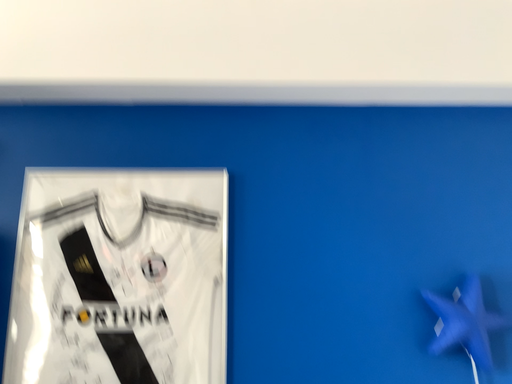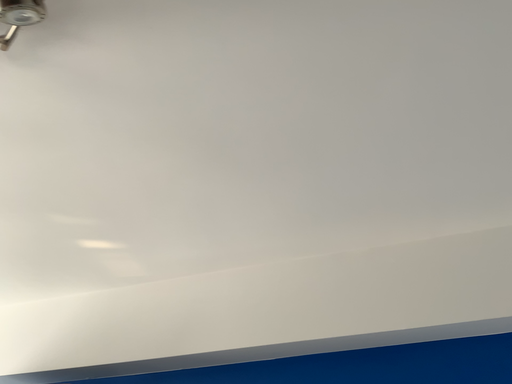
Question: How did the camera likely rotate when shooting the video?

Choices:
 (A) rotated downward
 (B) rotated upward

Answer: (B)